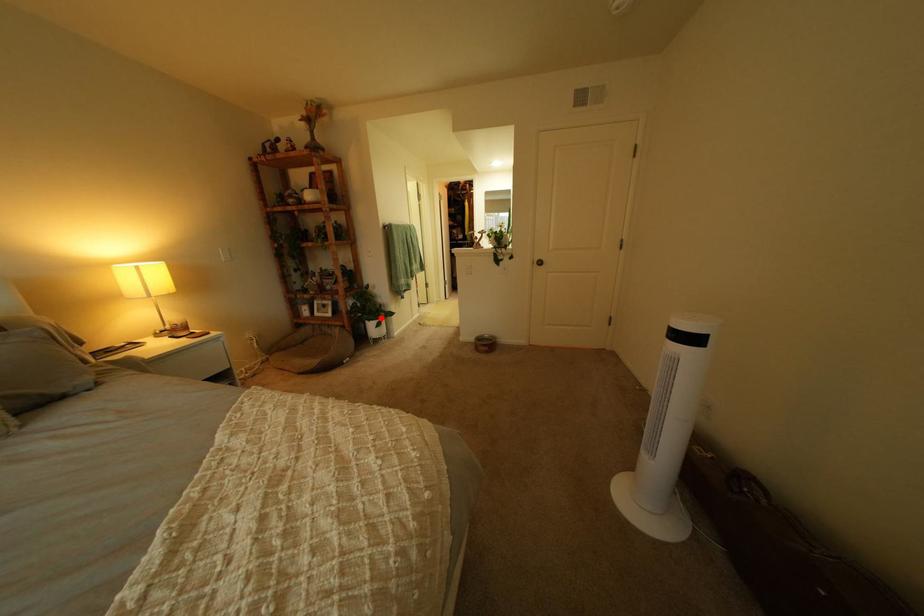
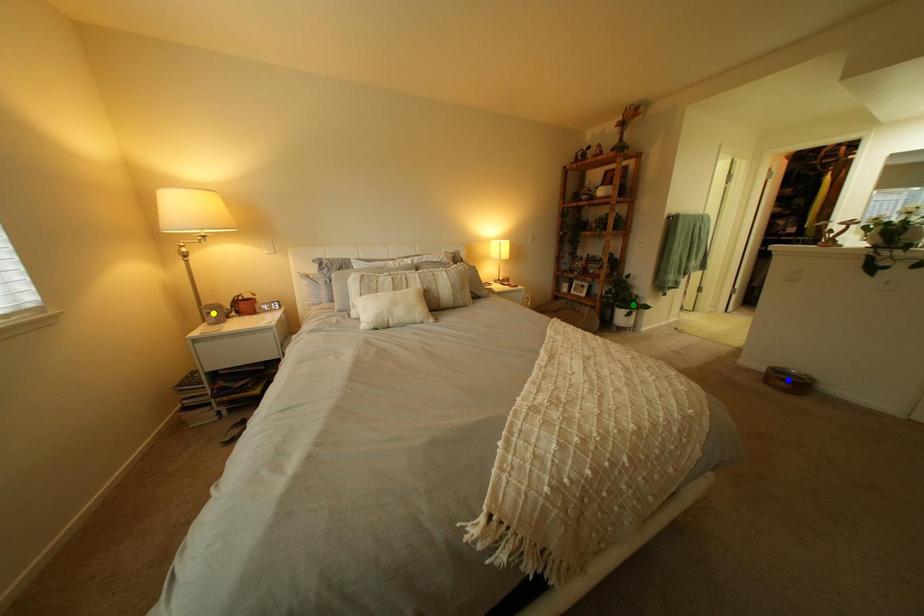
Question: I am providing you with two images of the same scene from different viewpoints. A red point is marked on the first image. You are given multiple points on the second image. Can you choose the point in image 2 that corresponds to the point in image 1?

Choices:
 (A) green point
 (B) yellow point
 (C) blue point

Answer: (A)